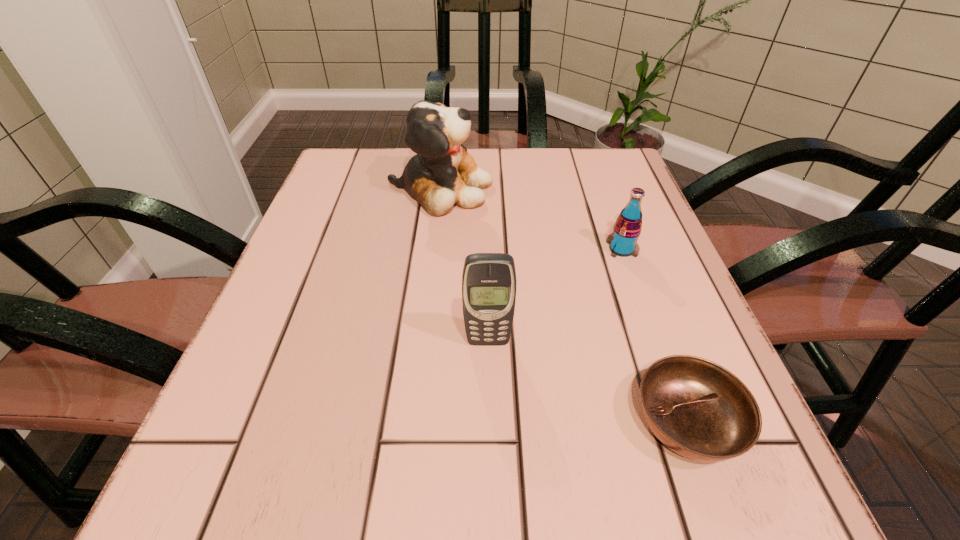
Locate an element on the screen. object situated at the far edge is located at coordinates 442,174.

Find the location of a particular element. The width and height of the screenshot is (960, 540). object situated at the near edge is located at coordinates (698, 409).

At what (x,y) coordinates should I click in order to perform the action: click on object located at the left edge. Please return your answer as a coordinate pair (x, y). The height and width of the screenshot is (540, 960). Looking at the image, I should click on (442, 174).

Where is `soda that is at the right edge`? The width and height of the screenshot is (960, 540). soda that is at the right edge is located at coordinates (623, 241).

This screenshot has width=960, height=540. I want to click on soup bowl that is at the right edge, so click(698, 409).

Locate an element on the screen. Image resolution: width=960 pixels, height=540 pixels. object that is at the far left corner is located at coordinates (442, 174).

I want to click on object located at the near right corner, so click(x=698, y=409).

Find the location of a particular element. vacant space at the far edge of the desktop is located at coordinates (516, 192).

Locate an element on the screen. free space at the near edge is located at coordinates (418, 471).

The height and width of the screenshot is (540, 960). What are the coordinates of `free space at the left edge of the desktop` in the screenshot? It's located at (286, 327).